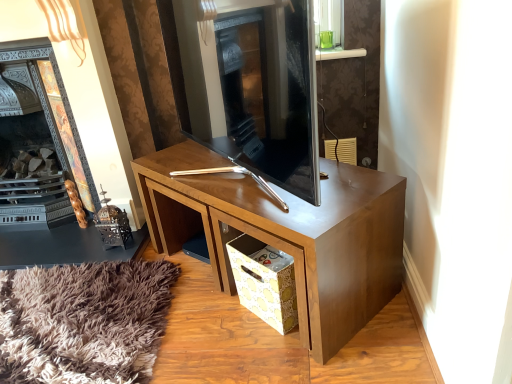
At what (x,y) coordinates should I click in order to perform the action: click on free point below dark gray stone fireplace at center, which ranks as the 2th fireplace in left-to-right order (from a real-world perspective). Please return your answer as a coordinate pair (x, y). The image size is (512, 384). Looking at the image, I should click on (219, 178).